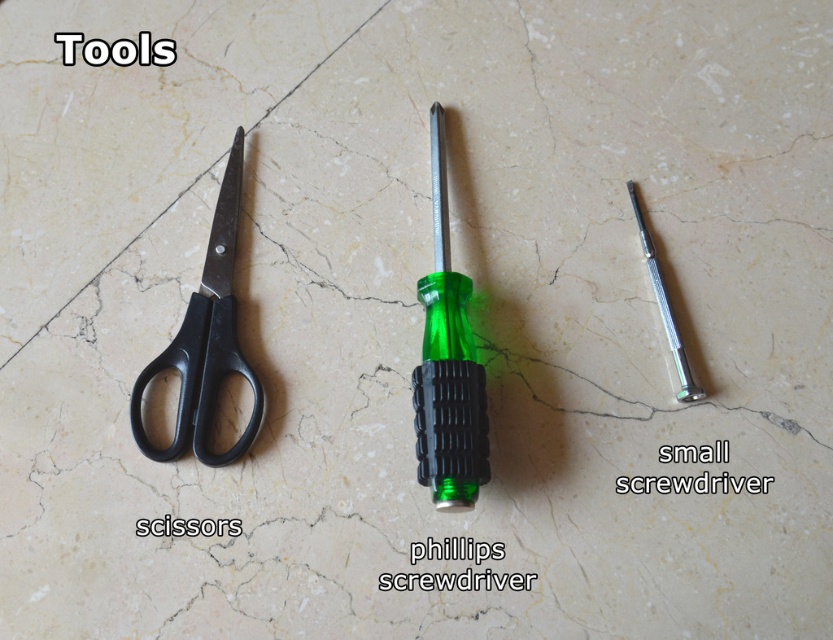
Image resolution: width=833 pixels, height=640 pixels. In order to click on green plastic screwdriver at center in this screenshot , I will do `click(447, 364)`.

Between green plastic screwdriver at center and metallic silver handle at center, which one appears on the left side from the viewer's perspective?

green plastic screwdriver at center is more to the left.

Is point (444, 333) in front of point (699, 392)?

No, it is behind (699, 392).

Locate an element on the screen. The width and height of the screenshot is (833, 640). green plastic screwdriver at center is located at coordinates (447, 364).

Consider the image. Is green plastic screwdriver at center smaller than black plastic scissors at left?

Yes, green plastic screwdriver at center is smaller than black plastic scissors at left.

From the picture: Is green plastic screwdriver at center to the left of black plastic scissors at left from the viewer's perspective?

No, green plastic screwdriver at center is not to the left of black plastic scissors at left.

Who is more forward, (442, 120) or (217, 260)?

Point (217, 260)

I want to click on green plastic screwdriver at center, so click(x=447, y=364).

Does black plastic scissors at left appear on the left side of metallic silver handle at center?

Correct, you'll find black plastic scissors at left to the left of metallic silver handle at center.

Identify the location of black plastic scissors at left. (205, 342).

Is point (233, 179) closer to camera compared to point (639, 232)?

No, (233, 179) is further to viewer.

This screenshot has height=640, width=833. What are the coordinates of `black plastic scissors at left` in the screenshot? It's located at (205, 342).